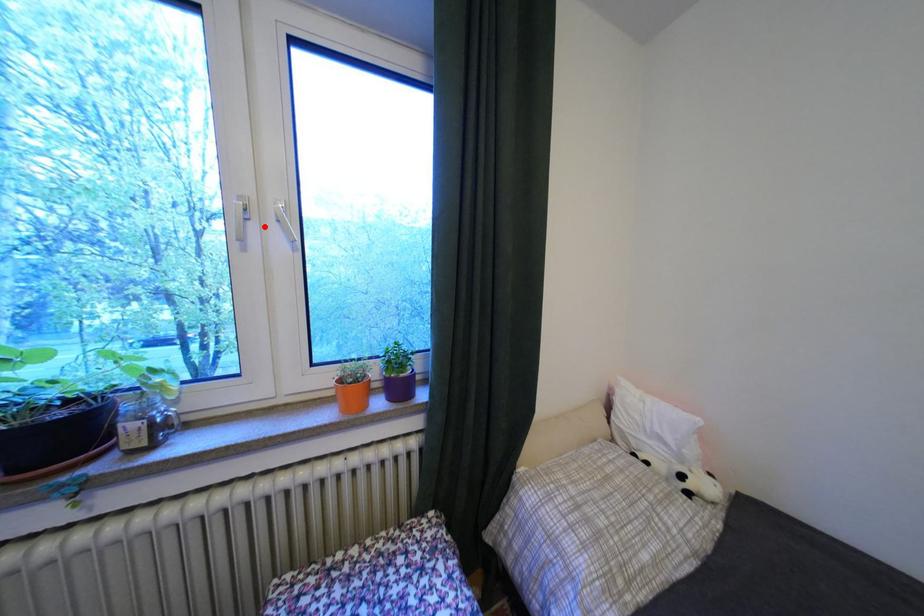
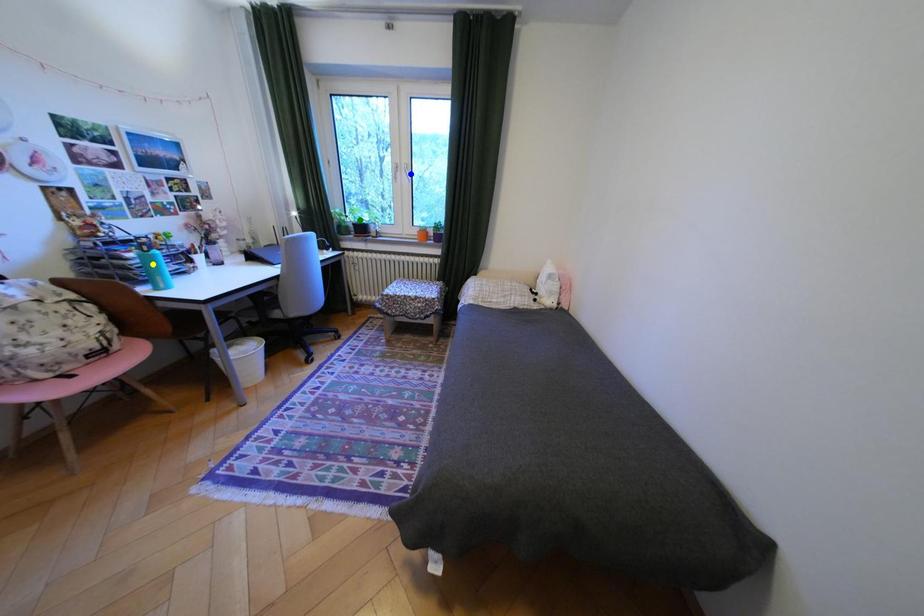
Question: I am providing you with two images of the same scene from different viewpoints. A red point is marked on the first image. You are given multiple points on the second image. Which mark in image 2 goes with the point in image 1?

Choices:
 (A) blue point
 (B) green point
 (C) yellow point

Answer: (A)